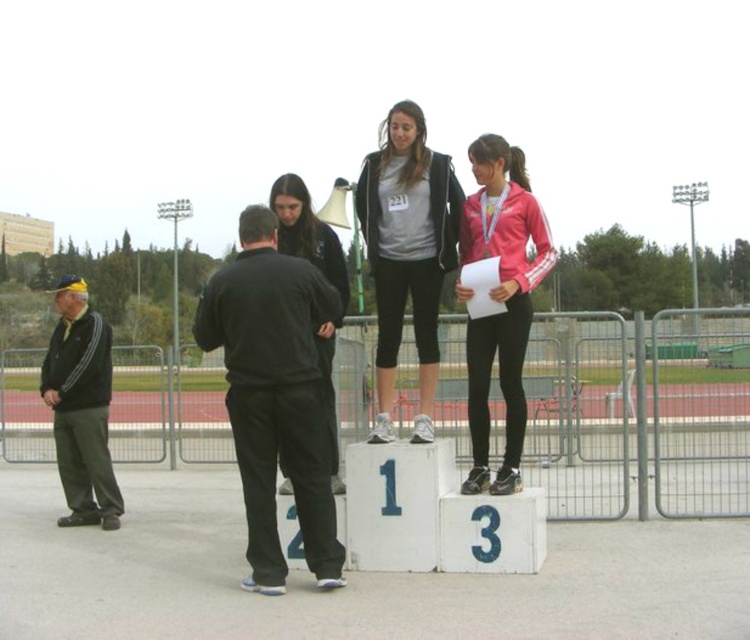
Which is behind, point (201, 340) or point (66, 406)?

Positioned behind is point (66, 406).

Which is in front, point (314, 483) or point (99, 339)?

Point (314, 483)

Locate an element on the screen. black matte pants at center is located at coordinates (274, 394).

Where is `black matte pants at center`? This screenshot has width=750, height=640. black matte pants at center is located at coordinates (274, 394).

How distant is black fabric jacket at left from black matte jacket at center?

black fabric jacket at left is 10.80 feet from black matte jacket at center.

Who is higher up, black fabric jacket at left or black matte jacket at center?

black matte jacket at center

Is point (51, 376) farther from camera compared to point (330, 355)?

Yes, point (51, 376) is farther from viewer.

Image resolution: width=750 pixels, height=640 pixels. What are the coordinates of `black fabric jacket at left` in the screenshot? It's located at [x=81, y=406].

Does point (417, 321) lie in front of point (330, 273)?

Yes.

Is matte gray hoodie at center taller than black matte jacket at center?

Yes, matte gray hoodie at center is taller than black matte jacket at center.

Where is `matte gray hoodie at center`? matte gray hoodie at center is located at coordinates (408, 252).

This screenshot has height=640, width=750. Identify the location of matte gray hoodie at center. (408, 252).